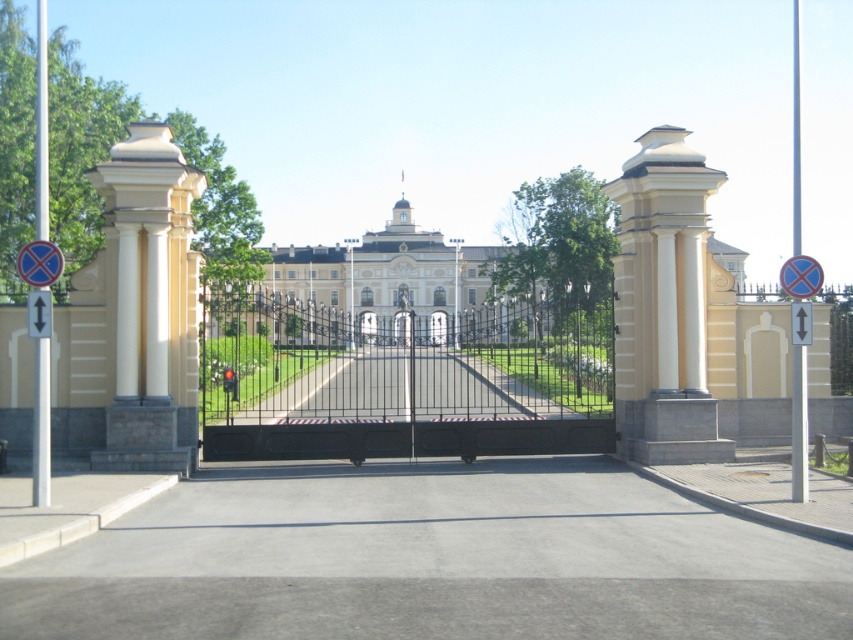
Can you confirm if black wrought iron gate at center is taller than blue plastic sign at upper left?

Yes.

Looking at this image, is black wrought iron gate at center to the right of blue plastic sign at upper left from the viewer's perspective?

Yes, black wrought iron gate at center is to the right of blue plastic sign at upper left.

Locate an element on the screen. The image size is (853, 640). black wrought iron gate at center is located at coordinates (403, 362).

I want to click on black wrought iron gate at center, so click(403, 362).

Between blue plastic sign at upper left and black metal gate at center, which one appears on the right side from the viewer's perspective?

Positioned to the right is black metal gate at center.

Is blue plastic sign at upper left wider than black metal gate at center?

In fact, blue plastic sign at upper left might be narrower than black metal gate at center.

At what (x,y) coordinates should I click in order to perform the action: click on blue plastic sign at upper left. Please return your answer as a coordinate pair (x, y). Image resolution: width=853 pixels, height=640 pixels. Looking at the image, I should click on (39, 262).

Between point (485, 506) and point (33, 330), which one is positioned behind?

The point (485, 506) is behind.

In the scene shown: Which is more to the right, gray concrete driveway at center or black plastic arrow at upper center?

gray concrete driveway at center is more to the right.

Who is more distant from viewer, (315, 474) or (44, 308)?

Point (315, 474)

The height and width of the screenshot is (640, 853). In order to click on gray concrete driveway at center in this screenshot , I will do `click(430, 560)`.